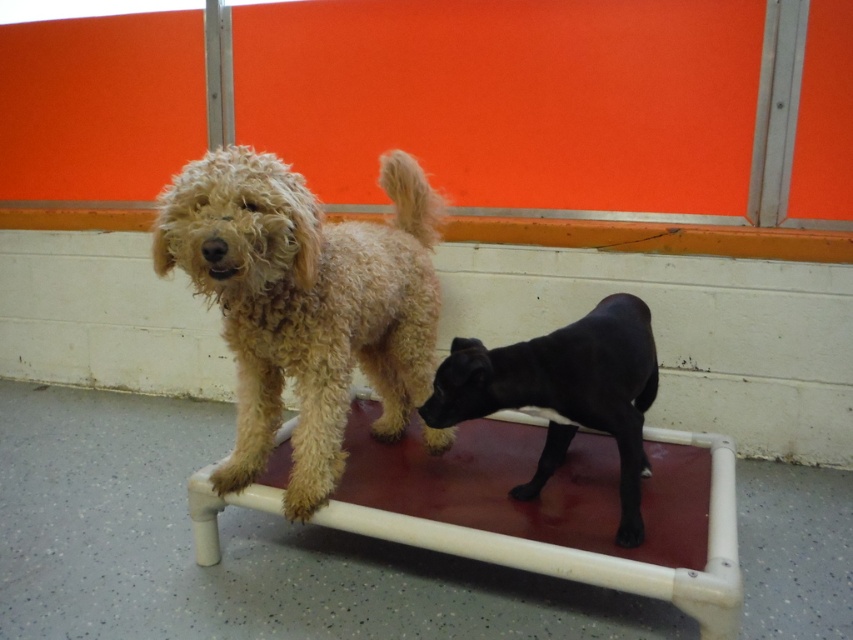
You are a pet groomer who needs to place a 20 inch long grooming table between the curly beige dog at center and the black smooth dog at center. Can the table fit between them without moving the dogs?

The distance between the curly beige dog at center and the black smooth dog at center is 18.80 inches. Since the table is 20 inches long, it cannot fit between them without moving the dogs because the table is longer than the space available.

You are a veterinarian who needs to place a small medical kit on the platform where the curly beige dog at center is located. The kit requires a flat area of 10x10 cm. Can you determine if there is enough space near the dog?

The curly beige dog at center is positioned at coordinates point (305,304). Since the platform has a red surface with white edges and the dog is at the center, there should be sufficient space around it to place the 10x10 cm medical kit.

You are a pet groomer who needs to choose a leash for each dog based on their size. The curly beige dog at center requires a leash that can handle larger breeds, while the black smooth dog at center needs one for smaller breeds. Which leash should each dog get?

The curly beige dog at center is larger in size than the black smooth dog at center, so the curly beige dog at center should get a leash for larger breeds and the black smooth dog at center should get a leash for smaller breeds.